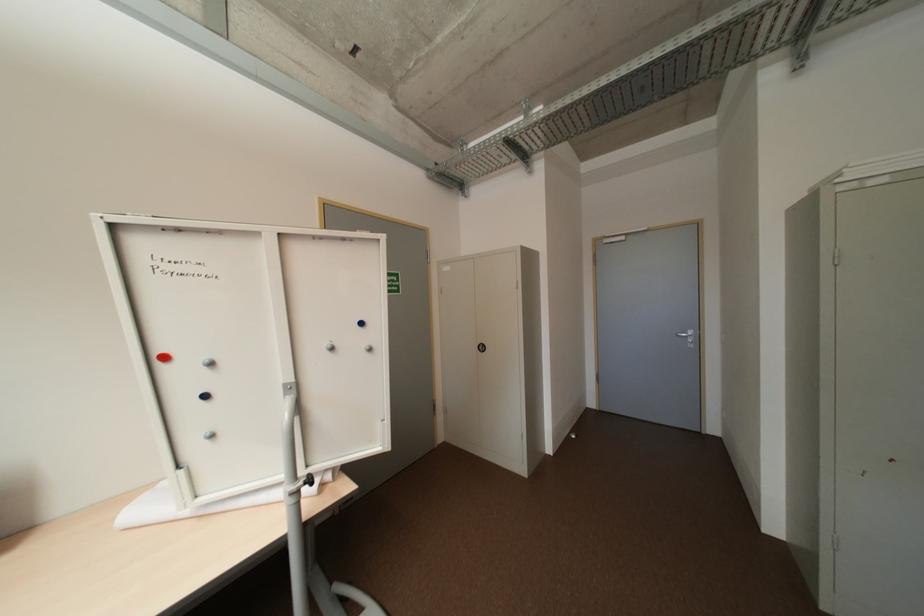
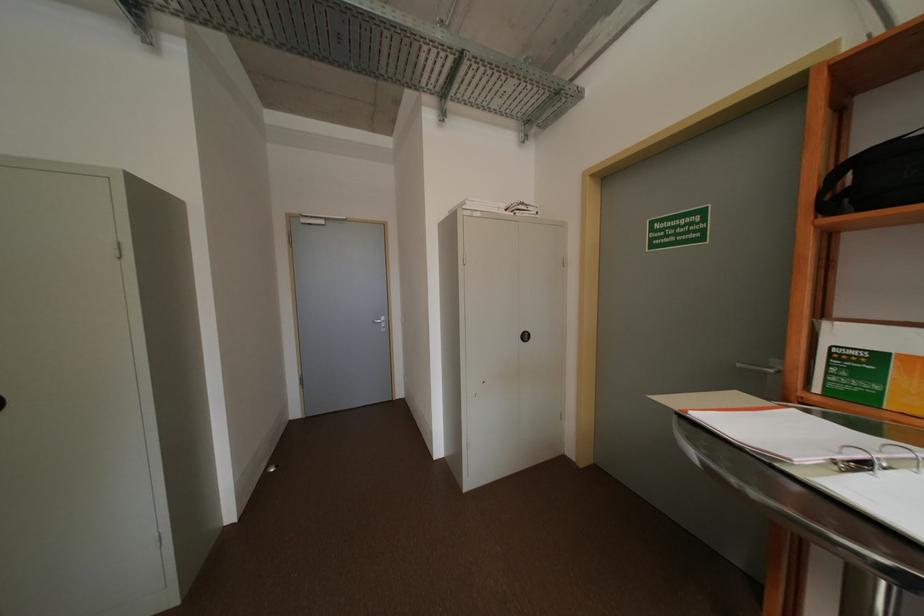
Question: How did the camera likely rotate?

Choices:
 (A) Left
 (B) Right
 (C) Up
 (D) Down

Answer: (B)